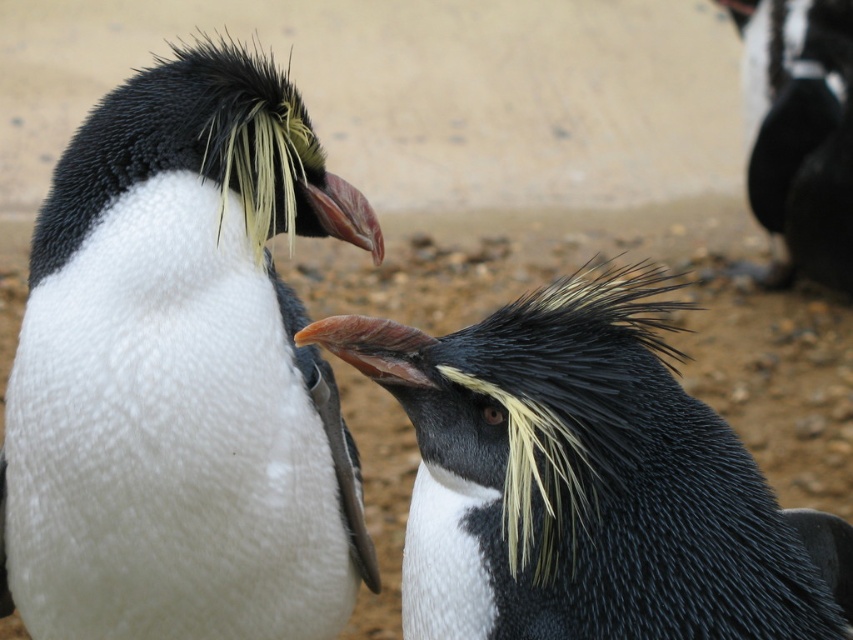
You are a wildlife photographer aiming to capture a closeup shot of both the white soft penguin at left and the black matte penguin at upper right. Your camera has a maximum focus range of 2.5 meters. Can you photograph both penguins clearly without moving your position?

The white soft penguin at left is 2.70 meters away from the black matte penguin at upper right. Since your camera can only focus up to 2.5 meters, you cannot capture both penguins clearly in the same shot without moving closer.